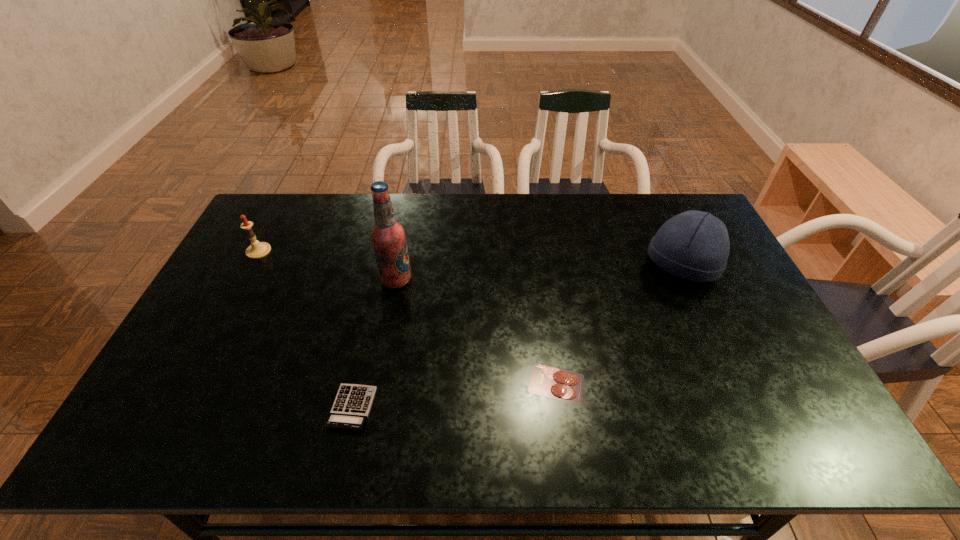
The height and width of the screenshot is (540, 960). Find the location of `free space between the calculator and the candle`. free space between the calculator and the candle is located at coordinates (305, 329).

Find the location of a particular element. vacant area that lies between the candle and the second object from right to left is located at coordinates (408, 317).

I want to click on empty location between the third tallest object and the fourth shortest object, so click(x=470, y=259).

The height and width of the screenshot is (540, 960). I want to click on free spot between the leftmost object and the alcohol, so click(x=327, y=265).

The width and height of the screenshot is (960, 540). Identify the location of free point between the second object from right to left and the leftmost object. (408, 317).

Locate an element on the screen. vacant space that's between the fourth tallest object and the rightmost object is located at coordinates (516, 337).

The width and height of the screenshot is (960, 540). Find the location of `free space between the rightmost object and the alcohol`. free space between the rightmost object and the alcohol is located at coordinates (539, 273).

The height and width of the screenshot is (540, 960). I want to click on free space between the fourth object from left to right and the rightmost object, so click(x=619, y=325).

Locate an element on the screen. vacant space in between the skullcap and the alcohol is located at coordinates (539, 273).

Identify which object is the nearest to the rightmost object. Please provide its 2D coordinates. Your answer should be formatted as a tuple, i.e. [(x, y)], where the tuple contains the x and y coordinates of a point satisfying the conditions above.

[(546, 381)]